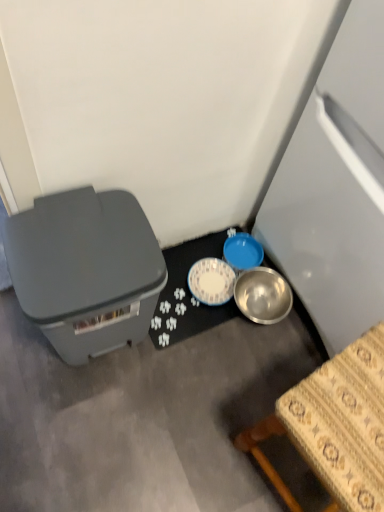
Identify the location of free space to the left of blue plastic bowl at center-right. (195, 253).